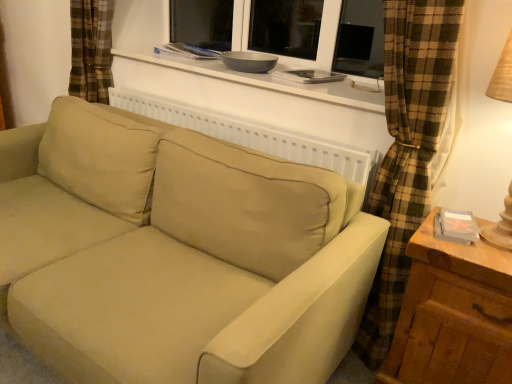
Question: From the image's perspective, would you say wooden at right is shown under beige fabric couch at center?

Choices:
 (A) yes
 (B) no

Answer: (A)

Question: Can you confirm if wooden at right is positioned to the left of beige fabric couch at center?

Choices:
 (A) yes
 (B) no

Answer: (B)

Question: Is wooden at right far from beige fabric couch at center?

Choices:
 (A) no
 (B) yes

Answer: (A)

Question: Does wooden at right have a lesser height compared to beige fabric couch at center?

Choices:
 (A) no
 (B) yes

Answer: (B)

Question: Considering the relative sizes of wooden at right and beige fabric couch at center in the image provided, is wooden at right thinner than beige fabric couch at center?

Choices:
 (A) yes
 (B) no

Answer: (A)

Question: Is wooden at right oriented towards beige fabric couch at center?

Choices:
 (A) no
 (B) yes

Answer: (A)

Question: Considering the relative positions of beige fabric couch at center and wooden at right in the image provided, is beige fabric couch at center to the left of wooden at right from the viewer's perspective?

Choices:
 (A) no
 (B) yes

Answer: (B)

Question: Can you see beige fabric couch at center touching wooden at right?

Choices:
 (A) no
 (B) yes

Answer: (A)

Question: Does beige fabric couch at center have a larger size compared to wooden at right?

Choices:
 (A) yes
 (B) no

Answer: (A)

Question: Is wooden at right inside beige fabric couch at center?

Choices:
 (A) no
 (B) yes

Answer: (A)

Question: From a real-world perspective, does beige fabric couch at center stand above wooden at right?

Choices:
 (A) no
 (B) yes

Answer: (B)

Question: Is beige fabric couch at center in front of wooden at right?

Choices:
 (A) yes
 (B) no

Answer: (A)

Question: From the image's perspective, is wooden at right above white matte window sill at upper center?

Choices:
 (A) no
 (B) yes

Answer: (A)